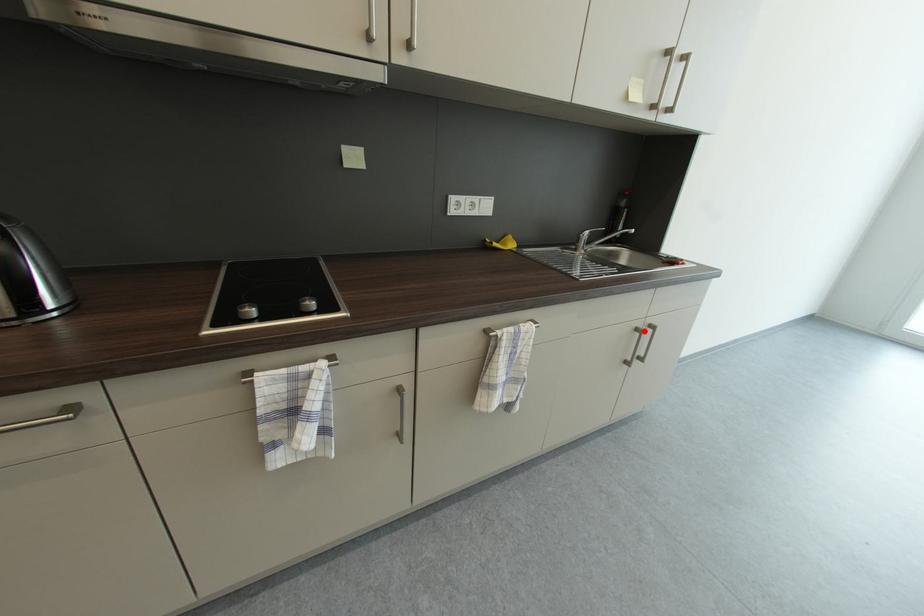
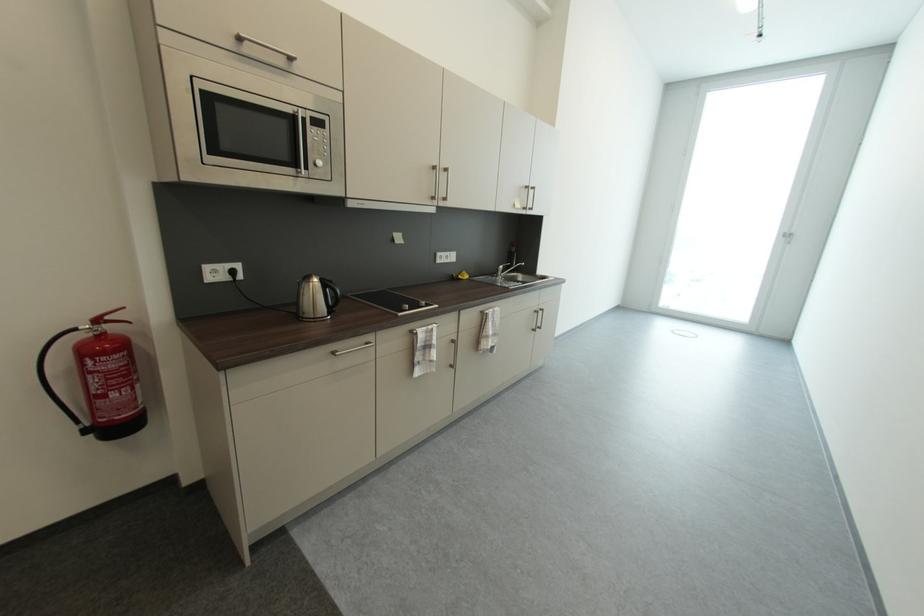
Find the pixel in the second image that matches the highlighted location in the first image.

(541, 313)